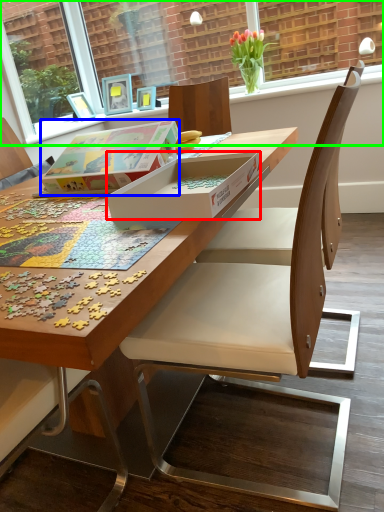
Question: Which object is positioned closest to box (highlighted by a red box)? Select from box (highlighted by a blue box) and window screen (highlighted by a green box).

Choices:
 (A) box
 (B) window screen

Answer: (A)